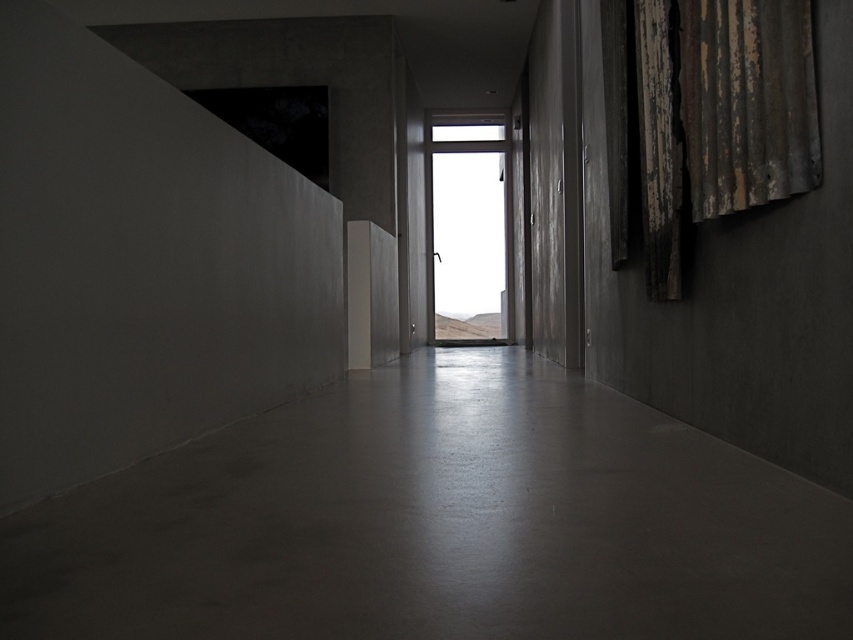
Does smooth concrete floor at center have a larger size compared to rusty corrugated metal curtain at right?

No, smooth concrete floor at center is not bigger than rusty corrugated metal curtain at right.

Does point (476, 525) lie in front of point (641, 202)?

That is True.

Does point (225, 541) lie in front of point (769, 22)?

That is True.

Where is `smooth concrete floor at center`? The width and height of the screenshot is (853, 640). smooth concrete floor at center is located at coordinates (438, 524).

Can you confirm if smooth concrete floor at center is thinner than transparent glass window at center?

Correct, smooth concrete floor at center's width is less than transparent glass window at center's.

Does smooth concrete floor at center have a larger size compared to transparent glass window at center?

Incorrect, smooth concrete floor at center is not larger than transparent glass window at center.

Where is `smooth concrete floor at center`? smooth concrete floor at center is located at coordinates (438, 524).

Who is taller, rusty corrugated metal curtain at right or transparent glass window at center?

Standing taller between the two is transparent glass window at center.

Between point (780, 83) and point (430, 180), which one is positioned behind?

The point (430, 180) is more distant.

Image resolution: width=853 pixels, height=640 pixels. What are the coordinates of `rusty corrugated metal curtain at right` in the screenshot? It's located at (720, 115).